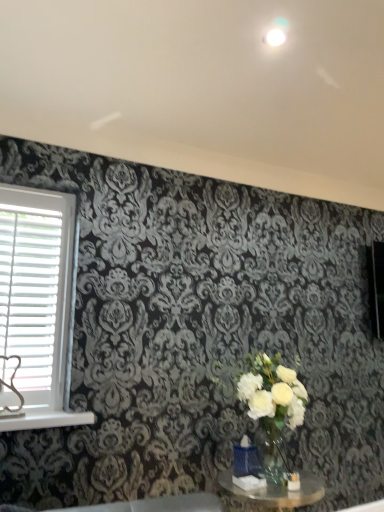
Question: Should I look upward or downward to see white plastic blinds at left?

Choices:
 (A) down
 (B) up

Answer: (A)

Question: Are clear glass table at lower center and white plastic window sill at lower left far apart?

Choices:
 (A) yes
 (B) no

Answer: (B)

Question: Is clear glass table at lower center turned away from white plastic window sill at lower left?

Choices:
 (A) yes
 (B) no

Answer: (B)

Question: Does clear glass table at lower center touch white plastic window sill at lower left?

Choices:
 (A) no
 (B) yes

Answer: (A)

Question: Is clear glass table at lower center shorter than white plastic window sill at lower left?

Choices:
 (A) no
 (B) yes

Answer: (A)

Question: From the image's perspective, is clear glass table at lower center below white plastic window sill at lower left?

Choices:
 (A) no
 (B) yes

Answer: (B)

Question: Considering the relative positions of clear glass table at lower center and white plastic window sill at lower left in the image provided, is clear glass table at lower center to the right of white plastic window sill at lower left from the viewer's perspective?

Choices:
 (A) yes
 (B) no

Answer: (A)

Question: Can you confirm if white plastic blinds at left is smaller than white plastic window sill at lower left?

Choices:
 (A) no
 (B) yes

Answer: (A)

Question: Would you say white plastic blinds at left contains white plastic window sill at lower left?

Choices:
 (A) no
 (B) yes

Answer: (A)

Question: Does white plastic blinds at left have a greater width compared to white plastic window sill at lower left?

Choices:
 (A) yes
 (B) no

Answer: (B)

Question: Can you confirm if white plastic blinds at left is thinner than white plastic window sill at lower left?

Choices:
 (A) no
 (B) yes

Answer: (B)

Question: Is white plastic blinds at left at the right side of white plastic window sill at lower left?

Choices:
 (A) no
 (B) yes

Answer: (A)

Question: From a real-world perspective, is white plastic blinds at left positioned under white plastic window sill at lower left based on gravity?

Choices:
 (A) no
 (B) yes

Answer: (A)

Question: From a real-world perspective, is white plastic blinds at left located beneath clear glass table at lower center?

Choices:
 (A) yes
 (B) no

Answer: (B)